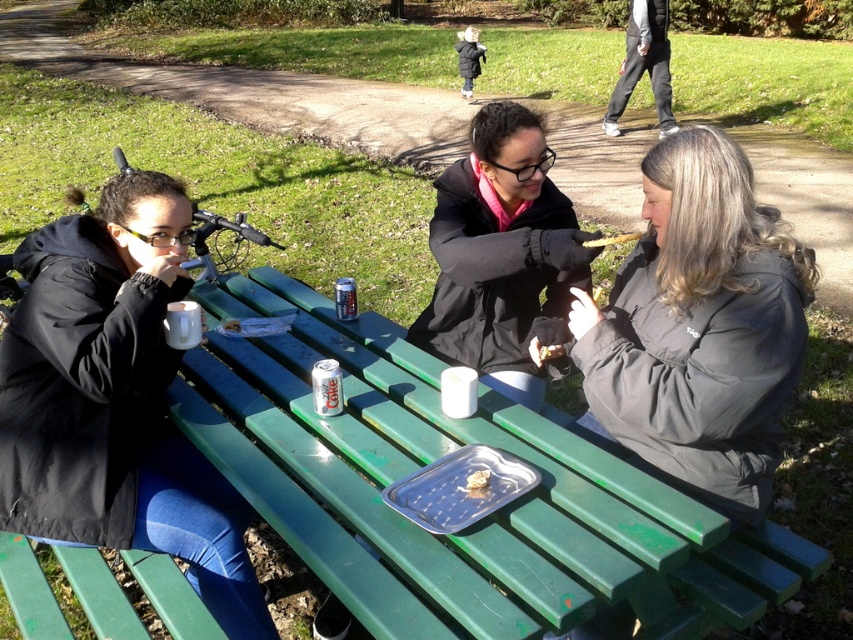
Question: Does gray matte jacket at center have a lesser width compared to white ceramic mug at left?

Choices:
 (A) no
 (B) yes

Answer: (A)

Question: Which is nearer to the matte black jacket at left?

Choices:
 (A) gray matte jacket at center
 (B) white ceramic mug at left
 (C) metallic blue can at center
 (D) black puffer jacket at upper center

Answer: (B)

Question: Which point is closer to the camera taking this photo?

Choices:
 (A) (463, 358)
 (B) (71, 410)
 (C) (459, 70)
 (D) (236, 332)

Answer: (B)

Question: Observing the image, what is the correct spatial positioning of silver metallic can at center in reference to white matte paper at center?

Choices:
 (A) above
 (B) below

Answer: (B)

Question: Among these points, which one is farthest from the camera?

Choices:
 (A) coord(337,365)
 (B) coord(239,324)
 (C) coord(636,236)

Answer: (B)

Question: Can you confirm if black puffer jacket at upper center is positioned below white matte paper at center?

Choices:
 (A) yes
 (B) no

Answer: (B)